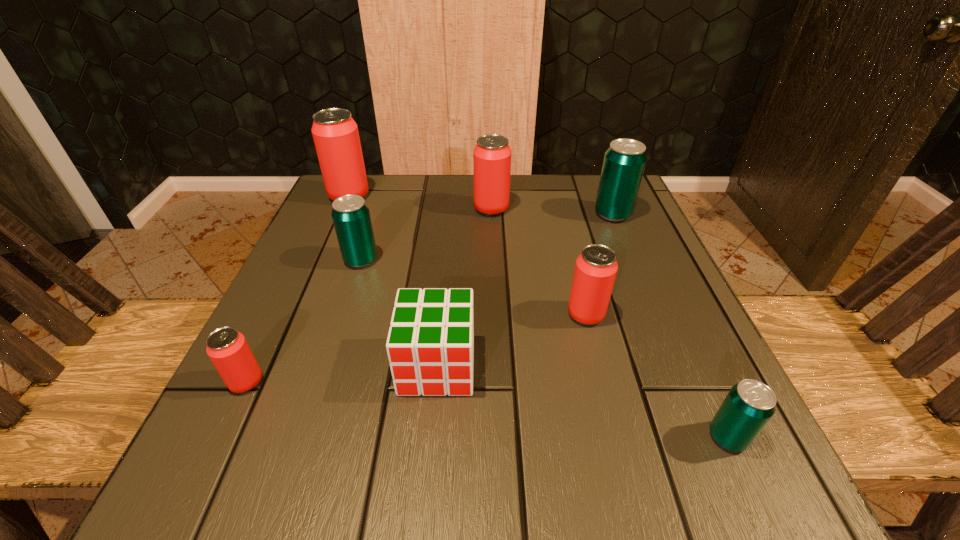
Locate an element on the screen. Image resolution: width=960 pixels, height=540 pixels. the nearest teal beer can is located at coordinates (750, 404).

Identify the location of the smallest teal beer can. (750, 404).

At what (x,y) coordinates should I click in order to perform the action: click on the nearest red beer can. Please return your answer as a coordinate pair (x, y). The image size is (960, 540). Looking at the image, I should click on (227, 348).

Find the location of a particular element. This screenshot has height=540, width=960. the smallest red beer can is located at coordinates (227, 348).

The image size is (960, 540). I want to click on free space located 0.090m on the right of the biggest red beer can, so click(x=406, y=196).

Find the location of `vacant space located on the front of the fourth beer can from right to left`. vacant space located on the front of the fourth beer can from right to left is located at coordinates (494, 306).

I want to click on free space located on the left of the biggest teal beer can, so click(431, 214).

Find the location of a particular element. Image resolution: width=960 pixels, height=540 pixels. vacant region located 0.380m on the front of the fourth farthest beer can is located at coordinates (296, 461).

The image size is (960, 540). I want to click on vacant space located 0.070m on the front of the fourth nearest object, so click(598, 361).

The image size is (960, 540). Find the location of `vacant space located 0.100m on the red face of the red cube`. vacant space located 0.100m on the red face of the red cube is located at coordinates (428, 464).